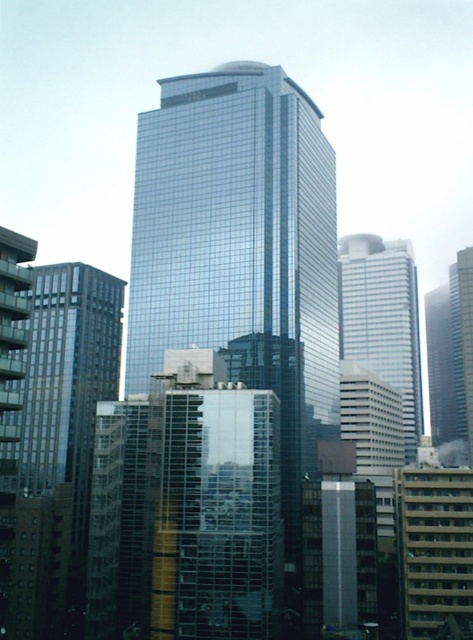
Who is higher up, beige concrete building at lower right or white glass building at center?

Positioned higher is white glass building at center.

Is beige concrete building at lower right above white glass building at center?

Actually, beige concrete building at lower right is below white glass building at center.

You are a GUI agent. You are given a task and a screenshot of the screen. Output one action in this format:
    pyautogui.click(x=<x>, y=<y>)
    Task: Click on the beige concrete building at lower right
    Image resolution: width=473 pixels, height=640 pixels.
    Given the screenshot: What is the action you would take?
    pyautogui.click(x=434, y=548)

Is shiny glass skyscraper at center to the left of white glass building at center from the viewer's perspective?

Correct, you'll find shiny glass skyscraper at center to the left of white glass building at center.

Does shiny glass skyscraper at center have a lesser height compared to white glass building at center?

Incorrect, shiny glass skyscraper at center's height does not fall short of white glass building at center's.

Who is more forward, (x=137, y=154) or (x=414, y=413)?

Point (x=137, y=154) is in front.

Where is `shiny glass skyscraper at center`? Image resolution: width=473 pixels, height=640 pixels. shiny glass skyscraper at center is located at coordinates click(x=241, y=250).

Which is more to the right, shiny glass skyscraper at center or beige concrete building at lower right?

Positioned to the right is beige concrete building at lower right.

From the picture: Does shiny glass skyscraper at center have a greater height compared to beige concrete building at lower right?

Yes.

Does point (231, 294) come behind point (445, 472)?

Yes, point (231, 294) is farther from viewer.

Image resolution: width=473 pixels, height=640 pixels. I want to click on shiny glass skyscraper at center, so click(241, 250).